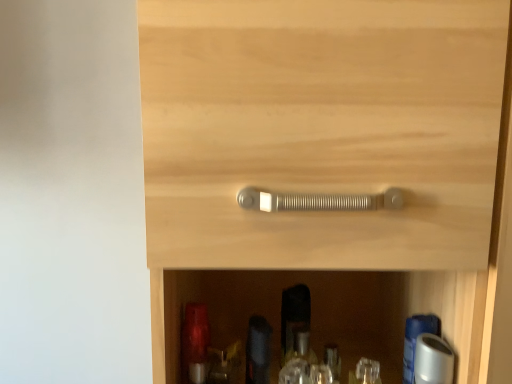
Question: From the image's perspective, is white glossy bottle at lower right, placed as the first bottle when sorted from right to left, positioned above or below clear plastic bottle at lower center, the second bottle in the right-to-left sequence?

Choices:
 (A) below
 (B) above

Answer: (B)

Question: Is white glossy bottle at lower right, arranged as the 4th bottle when viewed from the left, in front of or behind clear plastic bottle at lower center, the second bottle in the right-to-left sequence, in the image?

Choices:
 (A) behind
 (B) front

Answer: (B)

Question: Which object is the closest to the matte black bottle at lower center, placed as the third bottle when sorted from right to left?

Choices:
 (A) clear plastic bottle at lower center, the second bottle in the right-to-left sequence
 (B) matte red glass bottle at lower left, the first bottle from the left
 (C) matte silver handle at center
 (D) white glossy bottle at lower right, arranged as the 4th bottle when viewed from the left

Answer: (A)

Question: Considering the real-world distances, which object is closest to the matte silver handle at center?

Choices:
 (A) white glossy bottle at lower right, arranged as the 4th bottle when viewed from the left
 (B) matte black bottle at lower center, which is the 2th bottle in left-to-right order
 (C) clear plastic bottle at lower center, the second bottle in the right-to-left sequence
 (D) matte red glass bottle at lower left, which is the 4th bottle from right to left

Answer: (B)